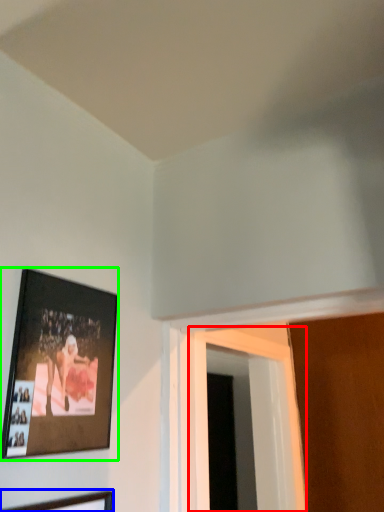
Question: Estimate the real-world distances between objects in this image. Which object is farther from window (highlighted by a red box), picture frame (highlighted by a blue box) or picture frame (highlighted by a green box)?

Choices:
 (A) picture frame
 (B) picture frame

Answer: (A)